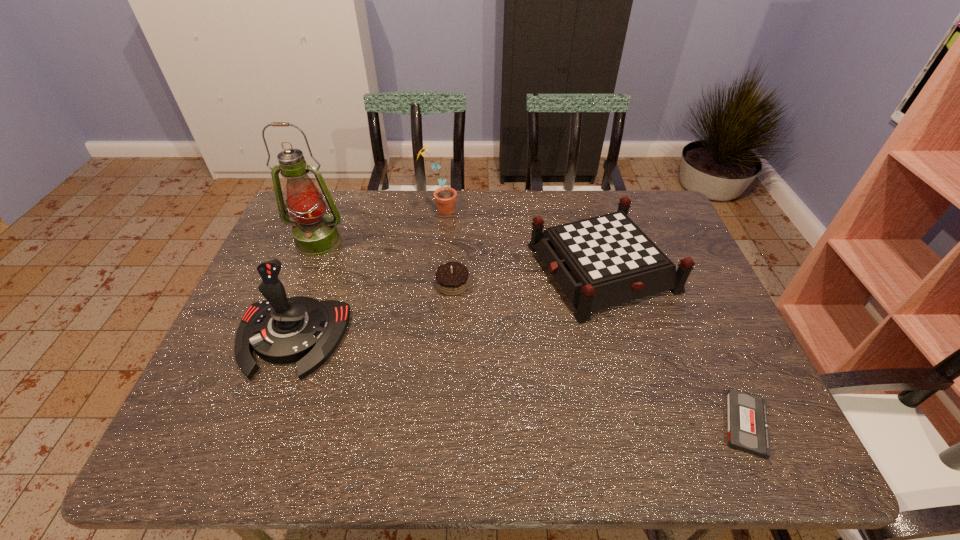
Locate an element on the screen. object identified as the second closest to the chocolate cake is located at coordinates click(280, 330).

At what (x,y) coordinates should I click in order to perform the action: click on the second closest object relative to the farthest object. Please return your answer as a coordinate pair (x, y). The height and width of the screenshot is (540, 960). Looking at the image, I should click on (600, 262).

This screenshot has width=960, height=540. I want to click on free spot that satisfies the following two spatial constraints: 1. on the flower of the third shortest object; 2. on the left side of the farthest object, so click(434, 268).

At what (x,y) coordinates should I click in order to perform the action: click on vacant space that satisfies the following two spatial constraints: 1. on the flower of the farthest object; 2. on the left side of the videotape. Please return your answer as a coordinate pair (x, y). Looking at the image, I should click on (417, 424).

Find the location of `vacant region that satisfies the following two spatial constraints: 1. on the front side of the shortest object; 2. on the left side of the checkerboard`. vacant region that satisfies the following two spatial constraints: 1. on the front side of the shortest object; 2. on the left side of the checkerboard is located at coordinates (646, 424).

This screenshot has height=540, width=960. I want to click on free space that satisfies the following two spatial constraints: 1. on the flower of the checkerboard; 2. on the right side of the farthest object, so click(434, 268).

Where is `free location that satisfies the following two spatial constraints: 1. on the handle side of the videotape; 2. on the right side of the joystick`? free location that satisfies the following two spatial constraints: 1. on the handle side of the videotape; 2. on the right side of the joystick is located at coordinates (258, 424).

You are a GUI agent. You are given a task and a screenshot of the screen. Output one action in this format:
    pyautogui.click(x=<x>, y=<y>)
    Task: Click on the vacant area that satisfies the following two spatial constraints: 1. on the flower of the second shortest object; 2. on the right side of the farthest object
    
    Given the screenshot: What is the action you would take?
    pyautogui.click(x=432, y=284)

The image size is (960, 540). In order to click on vacant space that satisfies the following two spatial constraints: 1. on the flower of the farthest object; 2. on the handle side of the joystick in this screenshot , I will do `click(426, 338)`.